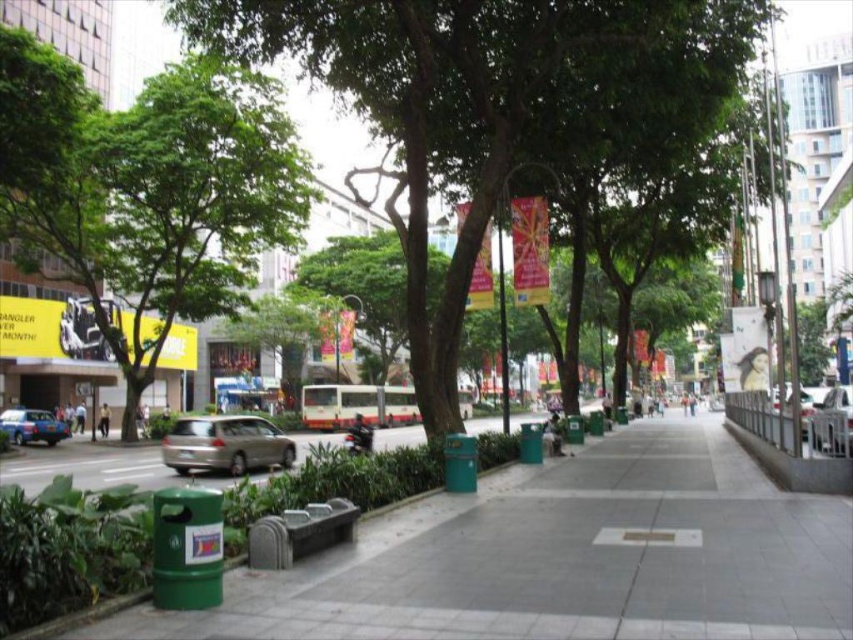
Question: Among these points, which one is nearest to the camera?

Choices:
 (A) (509, 129)
 (B) (296, 227)
 (C) (593, 449)
 (D) (842, 452)

Answer: (D)

Question: Is satin silver car at center-right positioned behind blue metallic car at left?

Choices:
 (A) yes
 (B) no

Answer: (B)

Question: Can you confirm if satin silver car at center-right is positioned above blue metallic car at left?

Choices:
 (A) no
 (B) yes

Answer: (B)

Question: Which object is closer to the camera taking this photo?

Choices:
 (A) green leafy tree at center
 (B) gold metallic car at center-left

Answer: (A)

Question: Is green leafy tree at left positioned at the back of satin silver car at center-right?

Choices:
 (A) no
 (B) yes

Answer: (B)

Question: Among these points, which one is farthest from the camera?

Choices:
 (A) (160, 148)
 (B) (827, 429)
 (C) (271, 611)

Answer: (A)